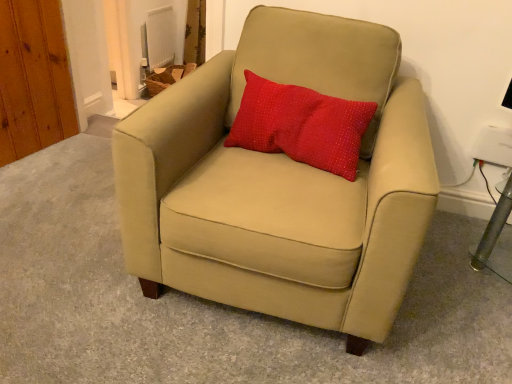
Question: Would you say suede beige armchair at center is to the left or to the right of red dotted fabric pillow at center in the picture?

Choices:
 (A) right
 (B) left

Answer: (B)

Question: From the image's perspective, is suede beige armchair at center located above or below red dotted fabric pillow at center?

Choices:
 (A) below
 (B) above

Answer: (A)

Question: From a real-world perspective, is suede beige armchair at center physically located above or below red dotted fabric pillow at center?

Choices:
 (A) above
 (B) below

Answer: (B)

Question: In terms of size, does red dotted fabric pillow at center appear bigger or smaller than suede beige armchair at center?

Choices:
 (A) small
 (B) big

Answer: (A)

Question: Which is correct: red dotted fabric pillow at center is inside suede beige armchair at center, or outside of it?

Choices:
 (A) inside
 (B) outside

Answer: (A)

Question: Considering the positions of point (330, 155) and point (169, 284), is point (330, 155) closer or farther from the camera than point (169, 284)?

Choices:
 (A) farther
 (B) closer

Answer: (A)

Question: Looking at their shapes, would you say red dotted fabric pillow at center is wider or thinner than suede beige armchair at center?

Choices:
 (A) wide
 (B) thin

Answer: (B)